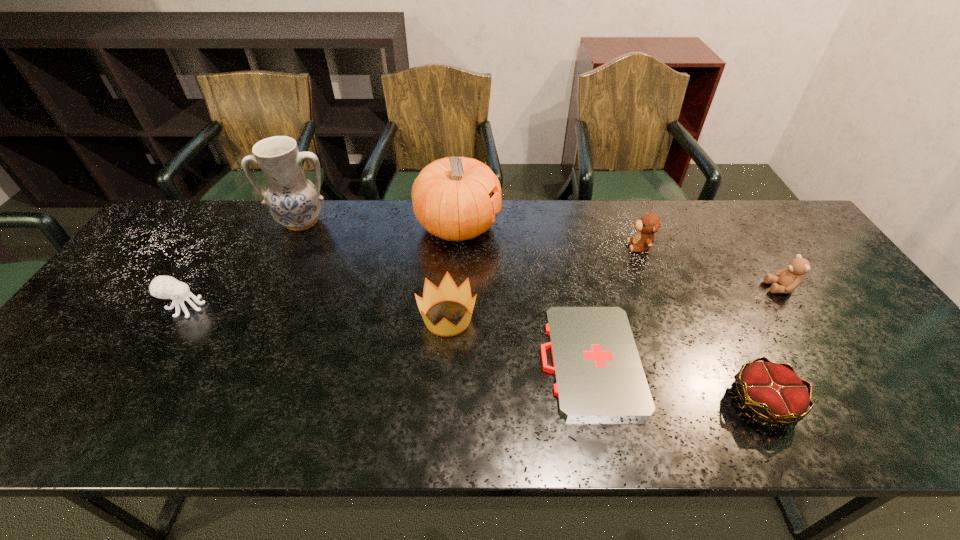
Identify the location of the second object from left to right. The height and width of the screenshot is (540, 960). (295, 202).

Image resolution: width=960 pixels, height=540 pixels. Find the location of `pumpkin`. pumpkin is located at coordinates (451, 196).

You are a GUI agent. You are given a task and a screenshot of the screen. Output one action in this format:
    pyautogui.click(x=<x>, y=<y>)
    Task: Click on the third object from right to left
    
    Given the screenshot: What is the action you would take?
    pyautogui.click(x=650, y=223)

You are a GUI agent. You are given a task and a screenshot of the screen. Output one action in this format:
    pyautogui.click(x=<x>, y=<y>)
    Task: Click on the left teddy bear
    The image size is (960, 540).
    Given the screenshot: What is the action you would take?
    coord(650,223)

The width and height of the screenshot is (960, 540). Identify the location of octopus. (164, 287).

Where is `the nearer teddy bear`? The width and height of the screenshot is (960, 540). the nearer teddy bear is located at coordinates (786, 280).

In order to click on the right teddy bear in this screenshot , I will do `click(786, 280)`.

Locate an element on the screen. This screenshot has width=960, height=540. the left crown is located at coordinates (447, 291).

At what (x,y) coordinates should I click in order to perform the action: click on the farther crown. Please return your answer as a coordinate pair (x, y). The height and width of the screenshot is (540, 960). Looking at the image, I should click on (447, 291).

The width and height of the screenshot is (960, 540). I want to click on the right crown, so click(772, 391).